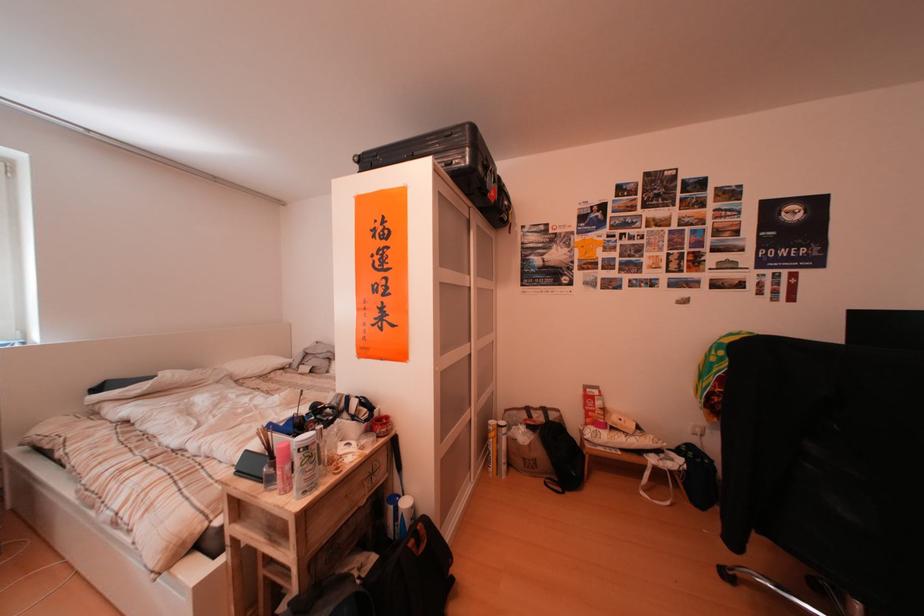
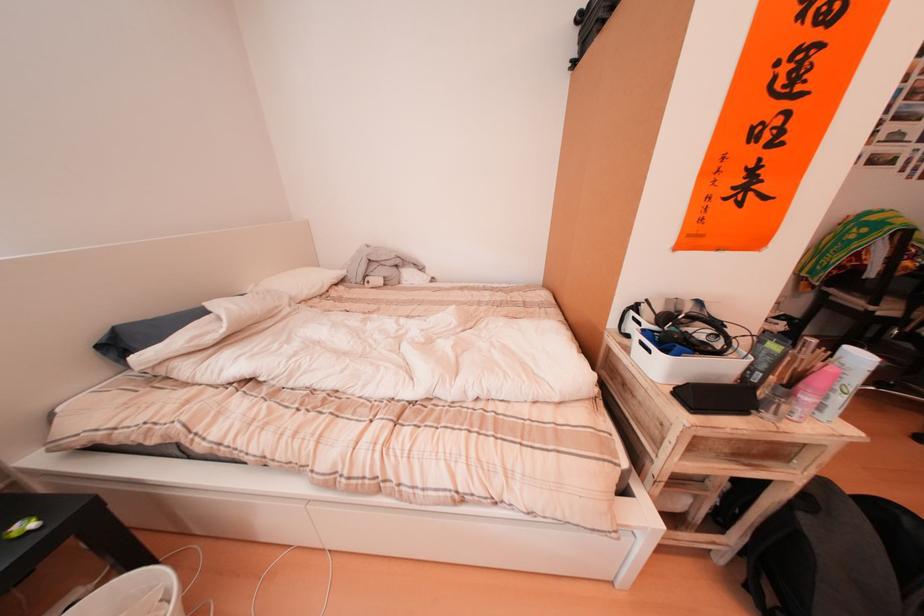
Locate, in the second image, the point that corresponds to point 108,389 in the first image.

(105, 339)